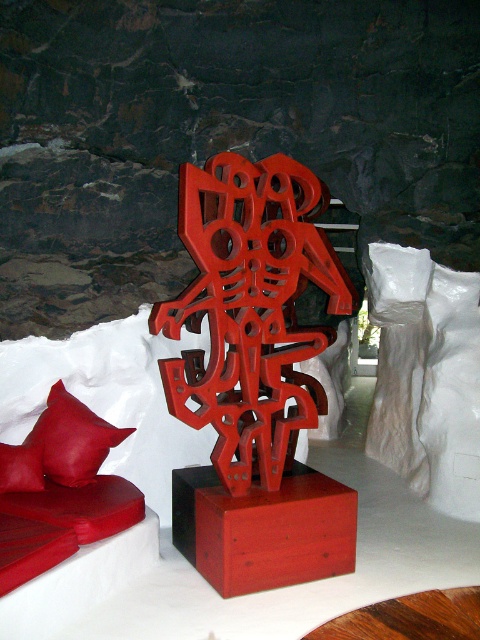
Question: Among these objects, which one is farthest from the camera?

Choices:
 (A) matte red sculpture at center
 (B) matte red pillow at lower left

Answer: (B)

Question: Based on their relative distances, which object is nearer to the matte leather pillow at lower left?

Choices:
 (A) matte wood table at center
 (B) matte red pillow at lower left
 (C) matte red sculpture at center

Answer: (B)

Question: Is the position of matte red sculpture at center less distant than that of matte leather pillow at lower left?

Choices:
 (A) yes
 (B) no

Answer: (A)

Question: In this image, where is matte red sculpture at center located relative to matte red pillow at lower left?

Choices:
 (A) left
 (B) right

Answer: (B)

Question: Among these points, which one is farthest from the camera?

Choices:
 (A) (250, 520)
 (B) (218, 188)

Answer: (B)

Question: Does matte leather pillow at lower left appear under matte red pillow at lower left?

Choices:
 (A) yes
 (B) no

Answer: (B)